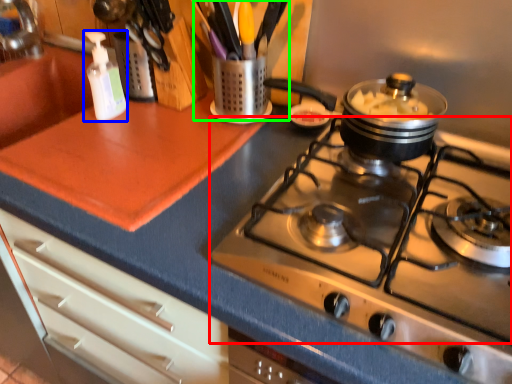
Question: Considering the real-world distances, which object is farthest from gas stove (highlighted by a red box)? bottle (highlighted by a blue box) or appliance (highlighted by a green box)?

Choices:
 (A) bottle
 (B) appliance

Answer: (A)